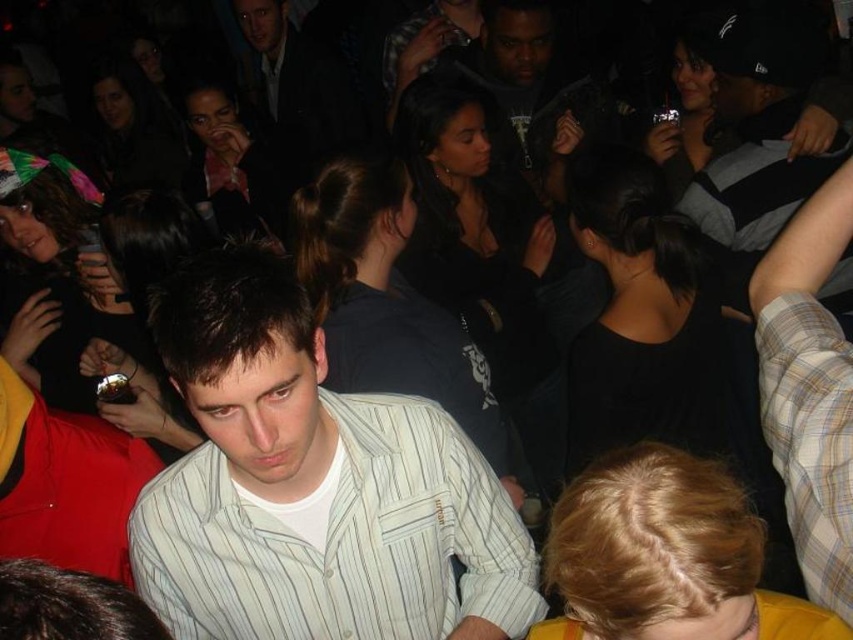
Question: Can you confirm if white striped shirt at center is positioned below striped shirt at upper right?

Choices:
 (A) yes
 (B) no

Answer: (A)

Question: Can you confirm if white striped shirt at center is positioned above striped shirt at upper right?

Choices:
 (A) yes
 (B) no

Answer: (B)

Question: Which object appears closest to the camera in this image?

Choices:
 (A) striped shirt at upper right
 (B) white striped shirt at center

Answer: (B)

Question: Where is white striped shirt at center located in relation to striped shirt at upper right in the image?

Choices:
 (A) above
 (B) below

Answer: (B)

Question: Which of the following is the closest to the observer?

Choices:
 (A) (769, 35)
 (B) (509, 614)

Answer: (B)